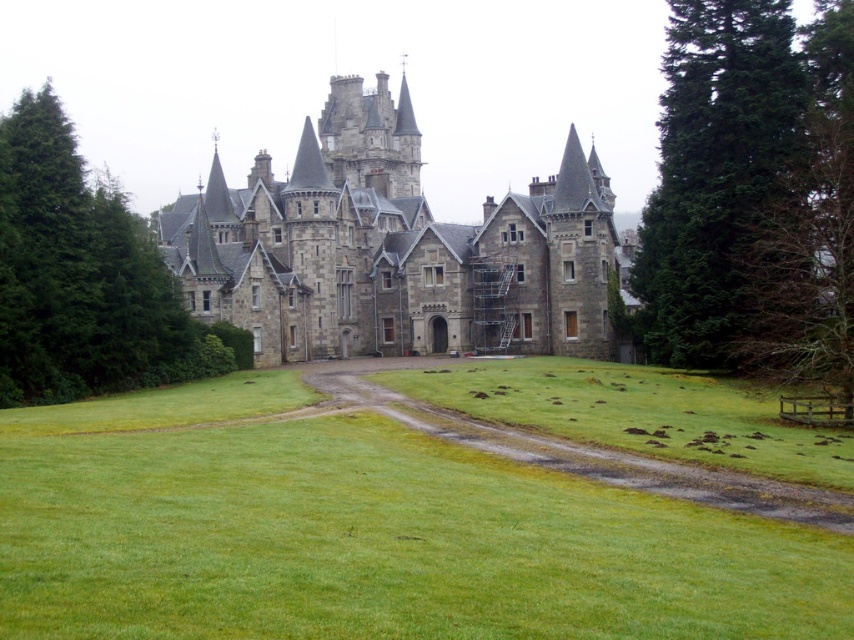
You are a knight approaching the castle and need to cross from the green grass at center to the green coniferous tree at right. Given that your horse can jump over obstacles up to 120 feet, will you be able to make the jump directly between them?

The distance between the green grass at center and the green coniferous tree at right is 120.14 feet, which exceeds the horse jump limit of 120 feet. Therefore, the jump cannot be made directly between them.

Looking at this image, you are a knight approaching the castle along the dirt path. You see the green grass at center and the green coniferous tree at right. Which object is closer to the castle entrance?

The green grass at center is closer to the castle entrance because it is positioned to the left of the green coniferous tree at right, which is further away from the entrance.

You are a knight approaching the castle entrance. You see the green grass at center and the gray stone castle at center. Which direction should you turn to face the castle from the grass?

You should turn to your left to face the gray stone castle at center from the green grass at center since the green grass at center is to the right of the castle.